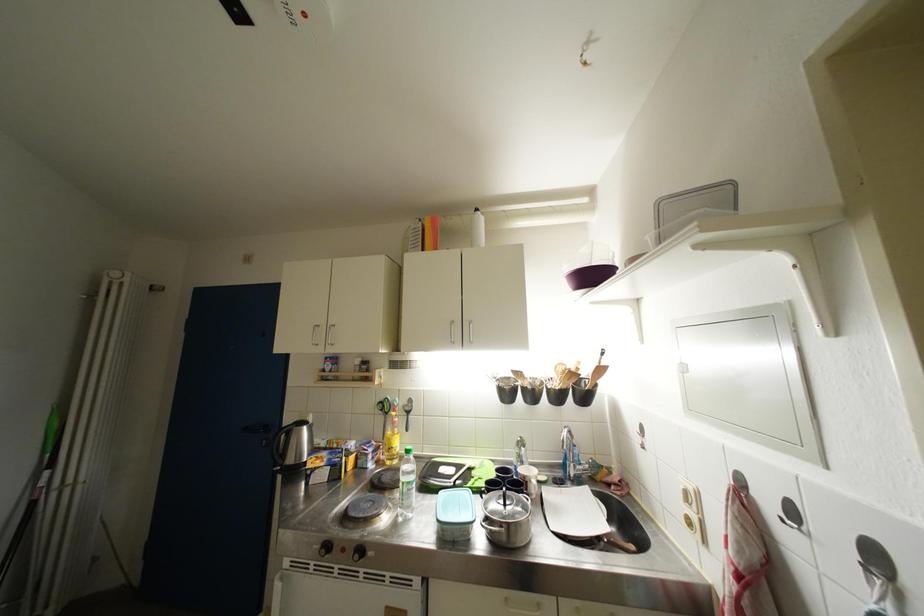
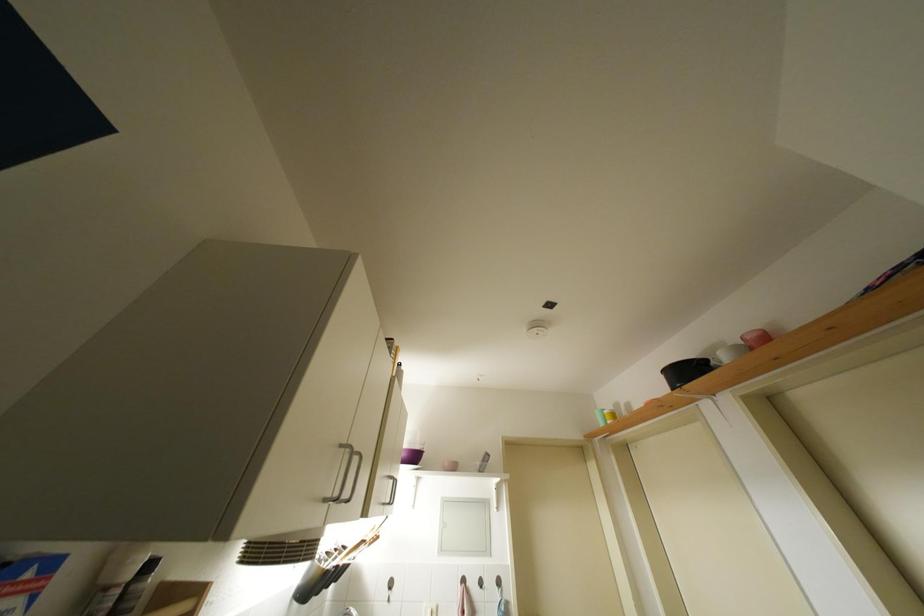
The point at (698,413) is marked in the first image. Where is the corresponding point in the second image?

(447, 554)